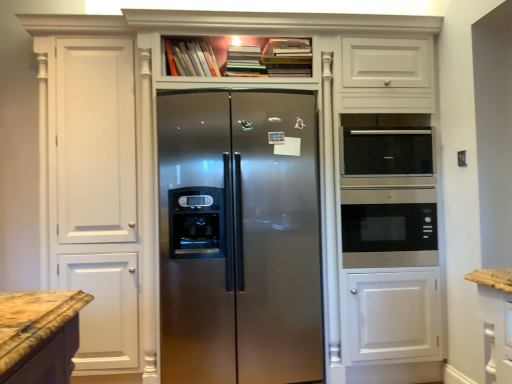
Question: In the image, is hardcover books at upper center, the 2th book from the left, on the left side or the right side of hardcover book at upper center, acting as the first book starting from the left?

Choices:
 (A) left
 (B) right

Answer: (B)

Question: Based on their sizes in the image, would you say hardcover books at upper center, which is the 2th book from right to left, is bigger or smaller than hardcover book at upper center, which is counted as the 3th book, starting from the right?

Choices:
 (A) big
 (B) small

Answer: (A)

Question: Based on their relative distances, which object is nearer to the black glass microwave at right?

Choices:
 (A) hardcover book at upper center, acting as the first book starting from the left
 (B) stainless steel refrigerator at center
 (C) hardcover books at upper center, the 2th book from the left
 (D) black glass microwave at upper right
 (E) hardcover books at upper center, which ranks as the first book in right-to-left order

Answer: (D)

Question: Which is farther from the hardcover books at upper center, the 2th book from the left?

Choices:
 (A) black glass microwave at right
 (B) stainless steel refrigerator at center
 (C) black glass microwave at upper right
 (D) hardcover books at upper center, which ranks as the first book in right-to-left order
 (E) hardcover book at upper center, which is counted as the 3th book, starting from the right

Answer: (A)